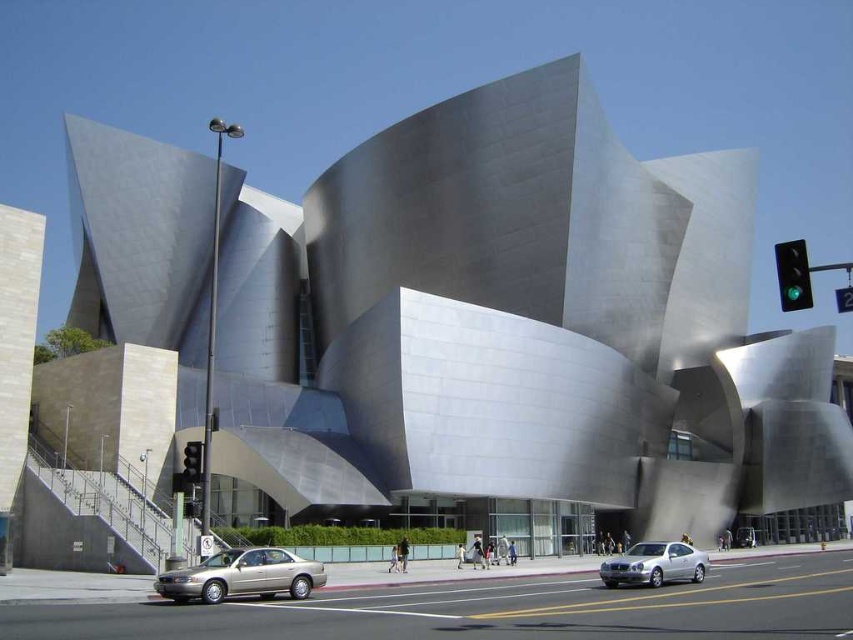
Question: Which point is farther from the camera taking this photo?

Choices:
 (A) (184, 461)
 (B) (656, 561)

Answer: (A)

Question: Which point appears farthest from the camera in this image?

Choices:
 (A) (189, 461)
 (B) (276, 572)
 (C) (657, 570)

Answer: (C)

Question: Which of the following is the farthest from the observer?

Choices:
 (A) green glass traffic light at upper right
 (B) silver metallic car at lower right
 (C) red glass traffic light at lower left

Answer: (B)

Question: Can you confirm if gold metallic sedan at lower center is thinner than silver metallic car at lower right?

Choices:
 (A) no
 (B) yes

Answer: (B)

Question: In this image, where is gold metallic sedan at lower center located relative to green glass traffic light at upper right?

Choices:
 (A) above
 (B) below

Answer: (B)

Question: Is green glass traffic light at upper right to the left of red glass traffic light at lower left from the viewer's perspective?

Choices:
 (A) yes
 (B) no

Answer: (B)